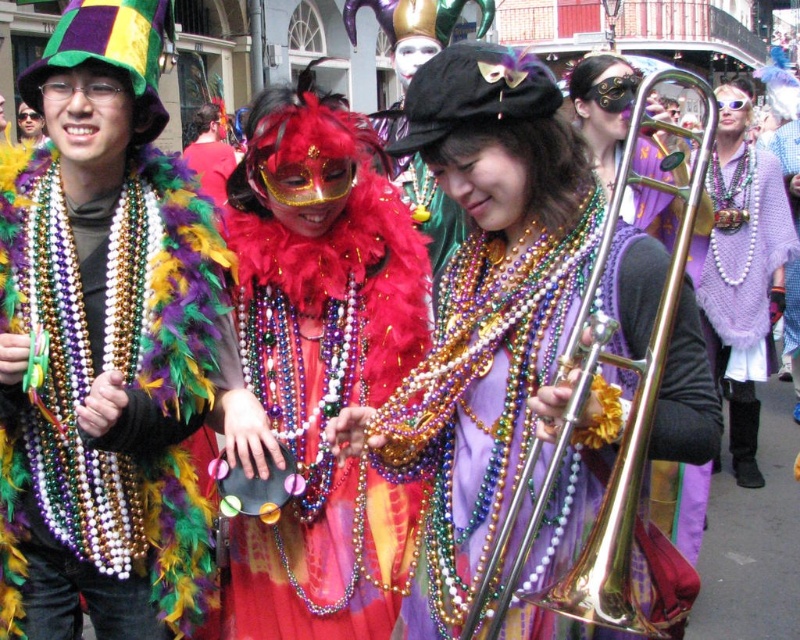
Does point (102, 420) come closer to viewer compared to point (709, 237)?

Yes.

Is matte black hat at upper left above pearl knitted shawl at right?

Incorrect, matte black hat at upper left is not positioned above pearl knitted shawl at right.

Locate an element on the screen. This screenshot has width=800, height=640. matte black hat at upper left is located at coordinates (104, 342).

Does shiny gold trombone at center have a larger size compared to matte black hat at center?

No.

Does shiny gold trombone at center appear over matte black hat at center?

Incorrect, shiny gold trombone at center is not positioned above matte black hat at center.

The image size is (800, 640). In order to click on shiny gold trombone at center in this screenshot , I will do `click(486, 305)`.

Does matte black hat at upper left appear over matte black hat at center?

No.

The height and width of the screenshot is (640, 800). Find the location of `matte black hat at upper left`. matte black hat at upper left is located at coordinates (104, 342).

The image size is (800, 640). I want to click on matte black hat at upper left, so click(104, 342).